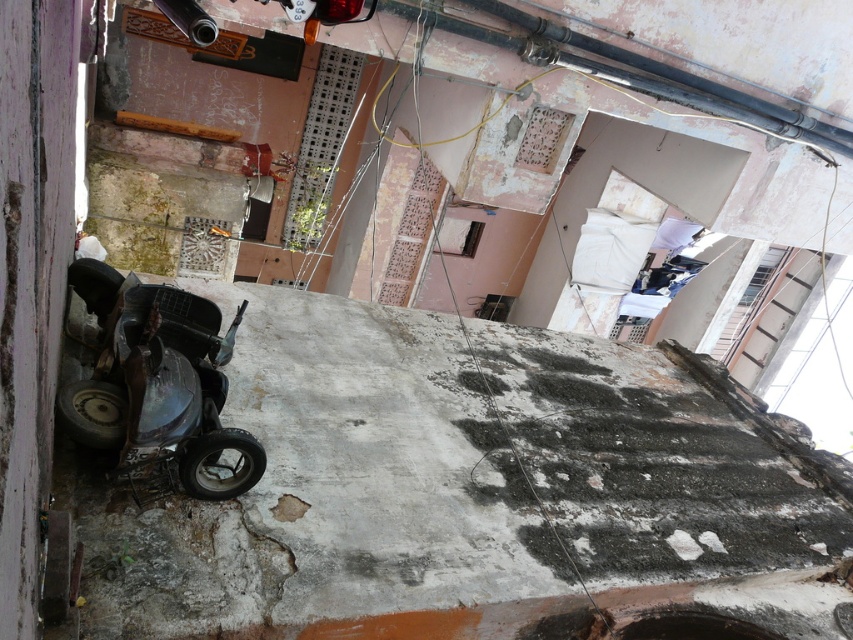
You are a delivery person trying to park your vehicle in this area. The gray concrete at lower left and the metallic matte mower at lower left are both in your way. Which one should you move to make more space?

The gray concrete at lower left is larger in size than the metallic matte mower at lower left, so you should move the metallic matte mower at lower left to make more space.

You are standing at the point marked as point (444, 486) in the image. What surface are you standing on?

You are standing on the gray concrete at lower left located at point (444, 486).